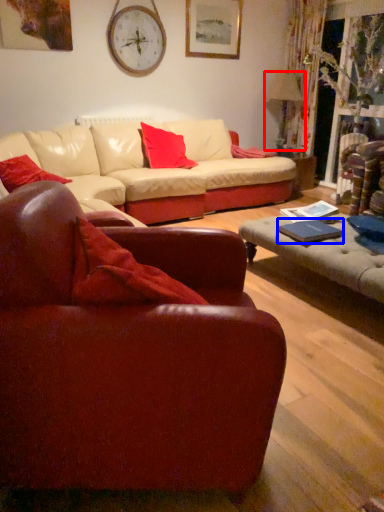
Question: Which point is further to the camera, lamp (highlighted by a red box) or pad (highlighted by a blue box)?

Choices:
 (A) lamp
 (B) pad

Answer: (A)